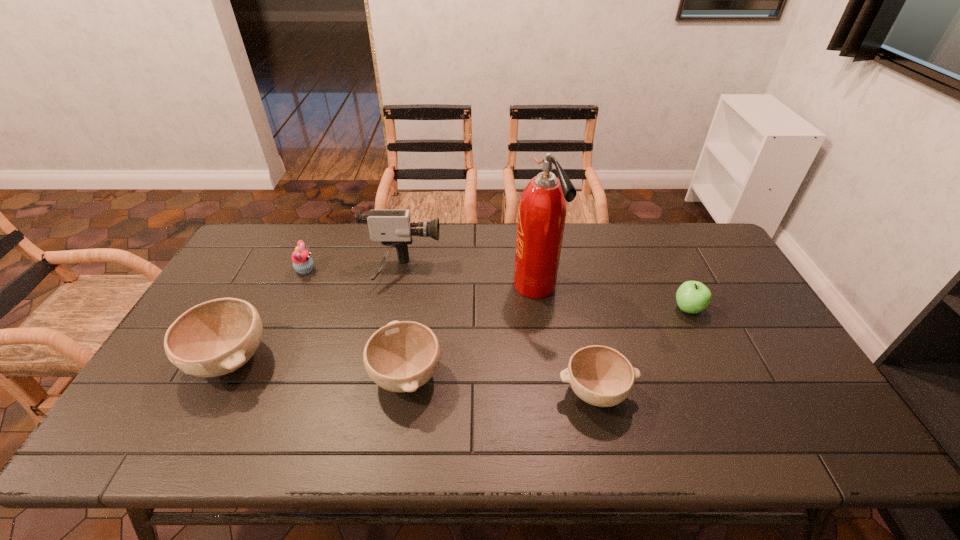
The bowls are evenly distributed in the image. To maintain this, where would you place another bowl on the right? Please point to a free space. Please provide its 2D coordinates. Your answer should be formatted as a tuple, i.e. [(x, y)], where the tuple contains the x and y coordinates of a point satisfying the conditions above.

[(797, 410)]